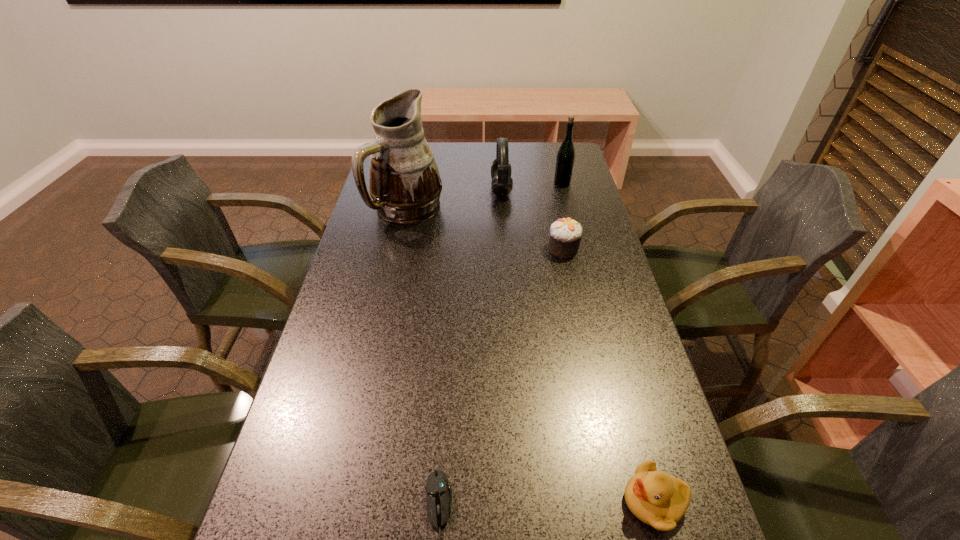
This screenshot has width=960, height=540. In the image, there is a desktop. Find the location of `vacant space at the far edge`. vacant space at the far edge is located at coordinates (472, 156).

I want to click on blank space at the left edge, so pyautogui.click(x=298, y=456).

The image size is (960, 540). In order to click on vacant space at the right edge of the desktop in this screenshot , I will do `click(572, 265)`.

Image resolution: width=960 pixels, height=540 pixels. I want to click on free space at the far right corner of the desktop, so click(539, 146).

Where is `free area in between the pitcher and the cupcake`? The height and width of the screenshot is (540, 960). free area in between the pitcher and the cupcake is located at coordinates (486, 229).

At what (x,y) coordinates should I click in order to perform the action: click on unoccupied area between the beer bottle and the pitcher. Please return your answer as a coordinate pair (x, y). This screenshot has height=540, width=960. Looking at the image, I should click on (485, 197).

The width and height of the screenshot is (960, 540). What are the coordinates of `unoccupied area between the duckling and the third nearest object` in the screenshot? It's located at coord(609,375).

This screenshot has height=540, width=960. I want to click on the closest object to the duckling, so click(x=438, y=490).

Locate which object is the closest to the second object from left to right. Please provide its 2D coordinates. Your answer should be formatted as a tuple, i.e. [(x, y)], where the tuple contains the x and y coordinates of a point satisfying the conditions above.

[(658, 499)]

The image size is (960, 540). I want to click on vacant space that satisfies the following two spatial constraints: 1. on the earcups of the third tallest object; 2. from the spout of the leftmost object, so click(502, 210).